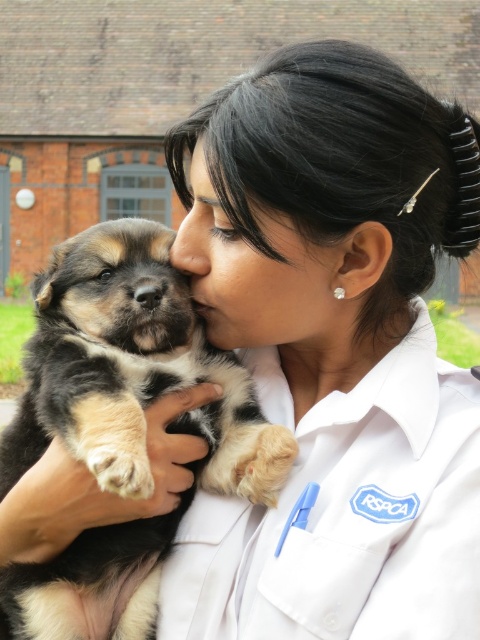
You are standing in front of the brick building and want to place a small flag at one of the two points, point 1 at point (442, 577) and point 2 at point (104, 348). Which point is closer to you so that the flag is more visible?

Point 1 at point (442, 577) is closer to the viewer, so placing the flag there would make it more visible.

Consider the image. You are a veterinarian who needs to place the soft fur puppy at center into a pet carrier that can only accommodate items up to the size of the white smooth lab coat at center. Based on the scene description, will the puppy fit?

The white smooth lab coat at center is larger than the soft fur puppy at center. Therefore, the puppy will fit into the pet carrier designed for the lab coat size.